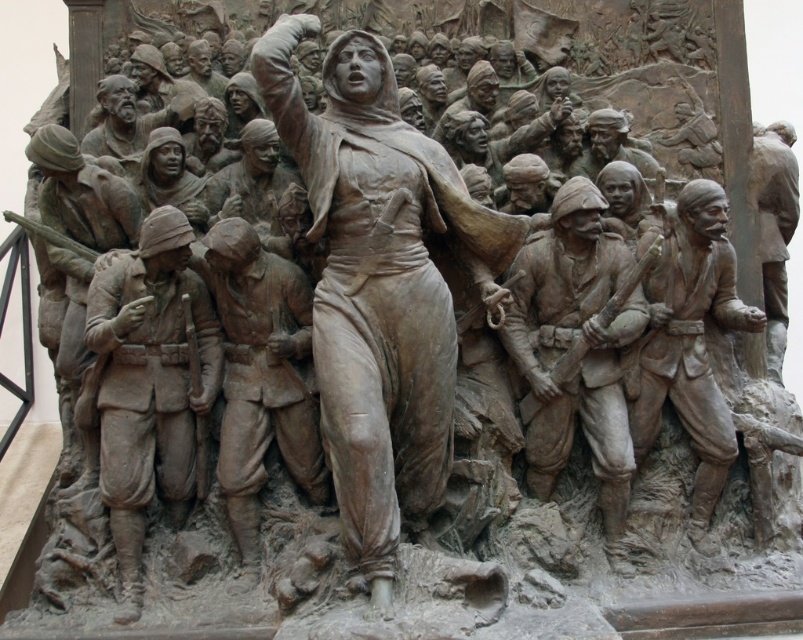
Question: Which of the following is the farthest from the observer?

Choices:
 (A) matte bronze soldier at center-left
 (B) matte bronze soldier at left
 (C) rustic bronze soldier at right
 (D) bronze statue at right

Answer: (D)

Question: Which object is closer to the camera taking this photo?

Choices:
 (A) bronze statue at right
 (B) rustic bronze soldier at right
 (C) bronze statue at center

Answer: (C)

Question: Which object appears farthest from the camera in this image?

Choices:
 (A) rustic bronze soldier at right
 (B) matte bronze soldier at center-left

Answer: (A)

Question: Is bronze statue at center to the right of matte bronze soldier at right from the viewer's perspective?

Choices:
 (A) no
 (B) yes

Answer: (A)

Question: Can you confirm if matte bronze soldier at right is positioned below rustic bronze soldier at right?

Choices:
 (A) no
 (B) yes

Answer: (B)

Question: Does matte bronze soldier at right appear on the left side of rustic bronze soldier at right?

Choices:
 (A) yes
 (B) no

Answer: (A)